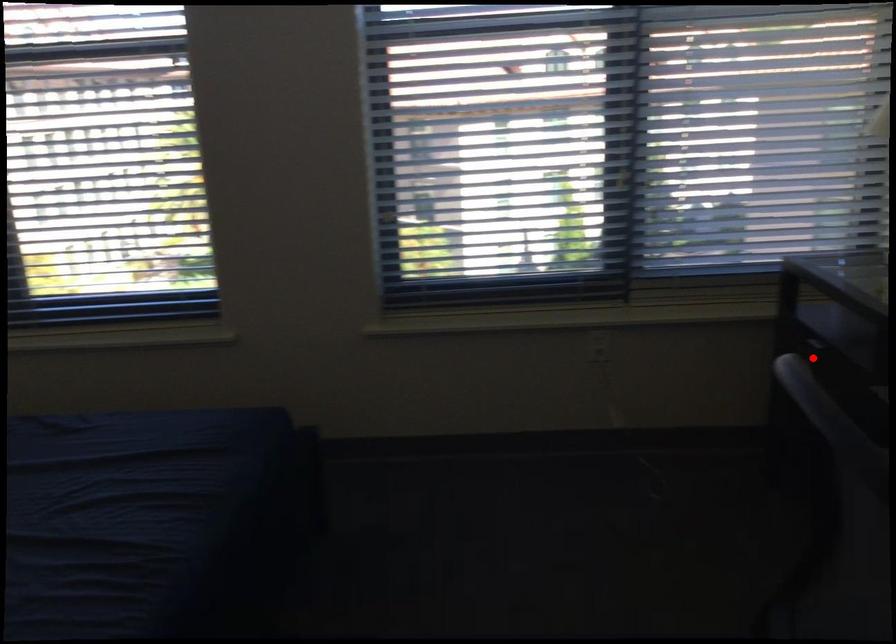
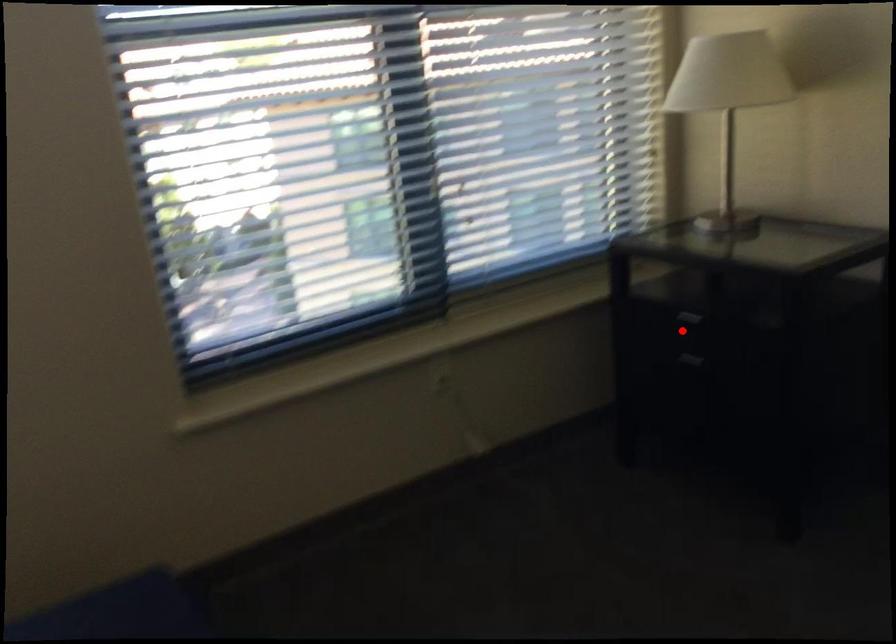
I am providing you with two images of the same scene from different viewpoints. A red point is marked on the first image and another point is marked on the second image. Is the red point in image1 aligned with the point shown in image2?

Yes